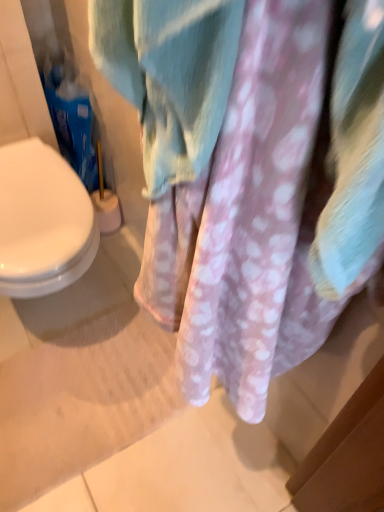
Question: In terms of width, does white plastic brush at lower left look wider or thinner when compared to pink fuzzy towel at center?

Choices:
 (A) wide
 (B) thin

Answer: (A)

Question: Does point (97, 167) appear closer or farther from the camera than point (188, 332)?

Choices:
 (A) closer
 (B) farther

Answer: (B)

Question: From their relative heights in the image, would you say white plastic brush at lower left is taller or shorter than pink fuzzy towel at center?

Choices:
 (A) short
 (B) tall

Answer: (A)

Question: From a real-world perspective, is pink fuzzy towel at center positioned above or below white plastic brush at lower left?

Choices:
 (A) above
 (B) below

Answer: (A)

Question: Is pink fuzzy towel at center wider or thinner than white plastic brush at lower left?

Choices:
 (A) wide
 (B) thin

Answer: (B)

Question: Does point (168, 108) appear closer or farther from the camera than point (117, 225)?

Choices:
 (A) closer
 (B) farther

Answer: (A)

Question: From the image's perspective, is pink fuzzy towel at center above or below white plastic brush at lower left?

Choices:
 (A) above
 (B) below

Answer: (B)